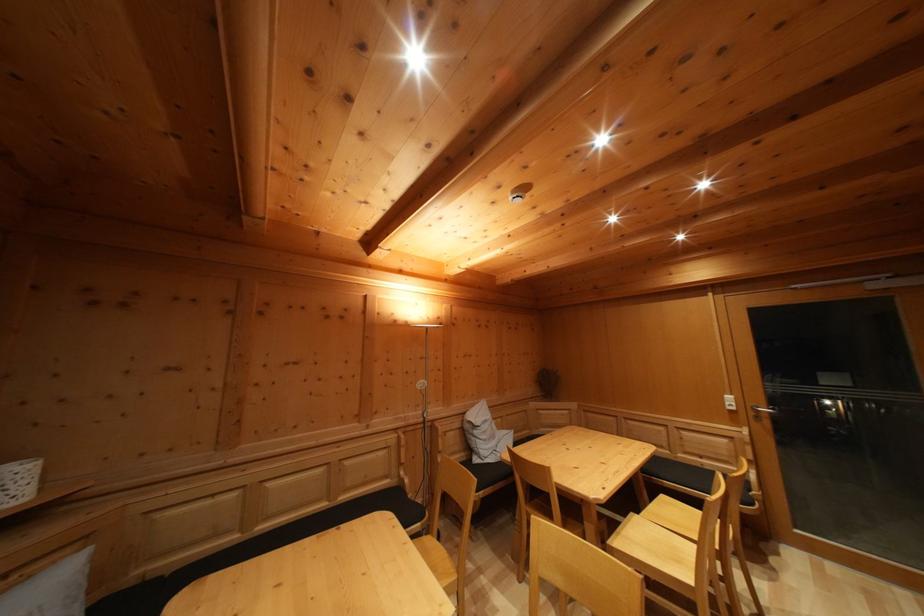
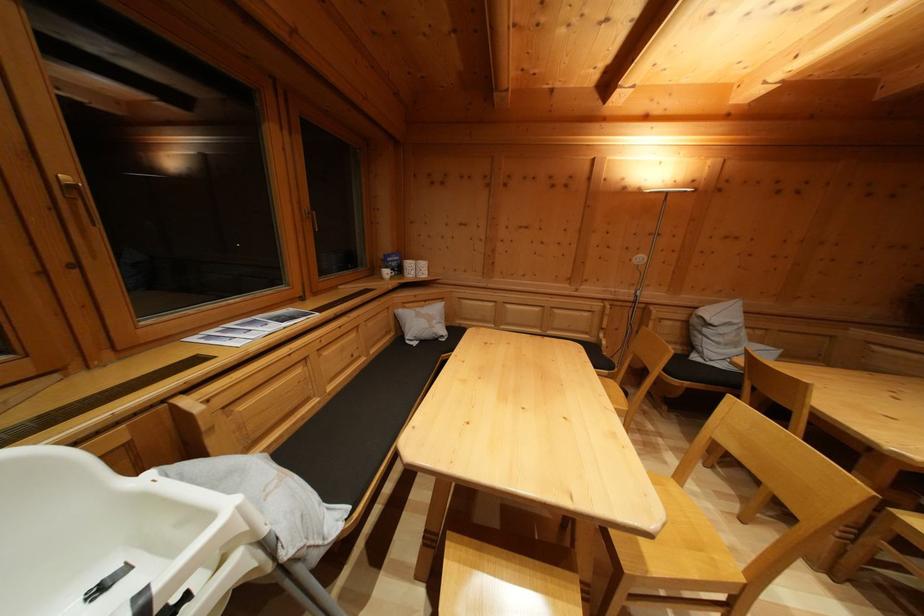
The point at (480, 439) is marked in the first image. Where is the corresponding point in the second image?

(711, 337)